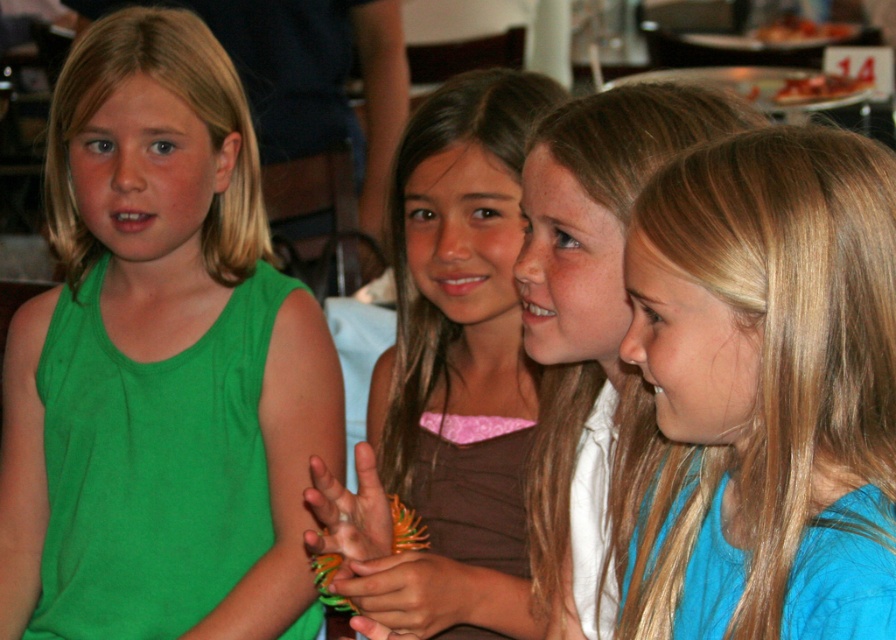
Question: Is brown matte shirt at center positioned in front of blue fabric shirt at center?

Choices:
 (A) no
 (B) yes

Answer: (A)

Question: Does blue fabric shirt at center appear over smooth orange bracelet at center?

Choices:
 (A) yes
 (B) no

Answer: (A)

Question: Estimate the real-world distances between objects in this image. Which object is closer to the brown matte shirt at center?

Choices:
 (A) blue smooth shirt at right
 (B) green fabric shirt at left
 (C) smooth orange bracelet at center
 (D) smooth orange ring at center

Answer: (C)

Question: Which of the following is the farthest from the observer?

Choices:
 (A) green fabric shirt at left
 (B) blue smooth shirt at right

Answer: (A)

Question: Which object is positioned farthest from the smooth orange ring at center?

Choices:
 (A) blue fabric shirt at center
 (B) blue smooth shirt at right

Answer: (B)

Question: Can you confirm if blue fabric shirt at center is positioned below smooth orange ring at center?

Choices:
 (A) no
 (B) yes

Answer: (A)